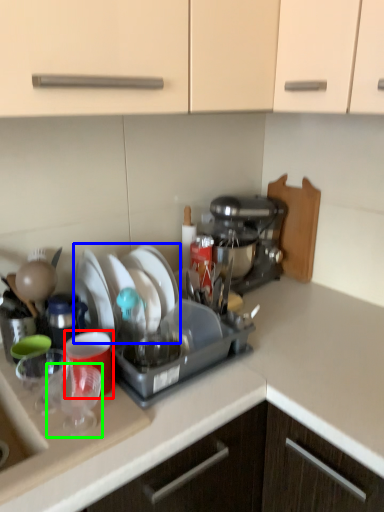
Question: Estimate the real-world distances between objects in this image. Which object is closer to coffee cup (highlighted by a red box), tableware (highlighted by a blue box) or tableware (highlighted by a green box)?

Choices:
 (A) tableware
 (B) tableware

Answer: (B)